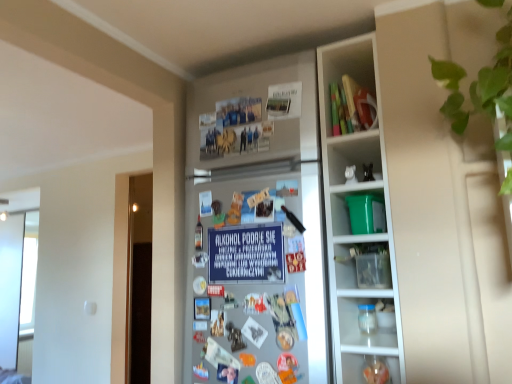
Question: Are green plastic bucket at upper right, which is counted as the 2th cabinet, starting from the top, and matte plastic toys at upper right, the 1th cabinet positioned from the top, making contact?

Choices:
 (A) no
 (B) yes

Answer: (A)

Question: Can you confirm if green plastic bucket at upper right, which is counted as the 2th cabinet, starting from the top, is taller than matte plastic toys at upper right, positioned as the 2th cabinet in bottom-to-top order?

Choices:
 (A) yes
 (B) no

Answer: (B)

Question: Does green plastic bucket at upper right, which is counted as the 2th cabinet, starting from the top, lie in front of matte plastic toys at upper right, the 1th cabinet positioned from the top?

Choices:
 (A) no
 (B) yes

Answer: (B)

Question: Is green plastic bucket at upper right, which is counted as the 2th cabinet, starting from the top, to the right of matte plastic toys at upper right, positioned as the 2th cabinet in bottom-to-top order, from the viewer's perspective?

Choices:
 (A) no
 (B) yes

Answer: (B)

Question: Is green plastic bucket at upper right, which is counted as the 2th cabinet, starting from the top, oriented towards matte plastic toys at upper right, positioned as the 2th cabinet in bottom-to-top order?

Choices:
 (A) yes
 (B) no

Answer: (B)

Question: Considering the positions of matte plastic toys at upper right, positioned as the 2th cabinet in bottom-to-top order, and transparent plastic jar at lower right in the image, is matte plastic toys at upper right, positioned as the 2th cabinet in bottom-to-top order, bigger or smaller than transparent plastic jar at lower right?

Choices:
 (A) small
 (B) big

Answer: (B)

Question: Is point (374, 74) closer or farther from the camera than point (384, 374)?

Choices:
 (A) closer
 (B) farther

Answer: (B)

Question: From a real-world perspective, is matte plastic toys at upper right, the 1th cabinet positioned from the top, physically located above or below transparent plastic jar at lower right?

Choices:
 (A) above
 (B) below

Answer: (A)

Question: Is matte plastic toys at upper right, positioned as the 2th cabinet in bottom-to-top order, in front of or behind transparent plastic jar at lower right in the image?

Choices:
 (A) front
 (B) behind

Answer: (B)

Question: Is blue paper sign at center wider or thinner than green leafy plant at upper right?

Choices:
 (A) wide
 (B) thin

Answer: (B)

Question: From a real-world perspective, is blue paper sign at center above or below green leafy plant at upper right?

Choices:
 (A) above
 (B) below

Answer: (B)

Question: Based on their sizes in the image, would you say blue paper sign at center is bigger or smaller than green leafy plant at upper right?

Choices:
 (A) small
 (B) big

Answer: (A)

Question: Considering their positions, is blue paper sign at center located in front of or behind green leafy plant at upper right?

Choices:
 (A) front
 (B) behind

Answer: (B)

Question: Would you say green leafy plant at upper right is to the left or to the right of green plastic bucket at upper right, which is counted as the 2th cabinet, starting from the top, in the picture?

Choices:
 (A) left
 (B) right

Answer: (B)

Question: From their relative heights in the image, would you say green leafy plant at upper right is taller or shorter than green plastic bucket at upper right, the first cabinet ordered from the bottom?

Choices:
 (A) short
 (B) tall

Answer: (B)